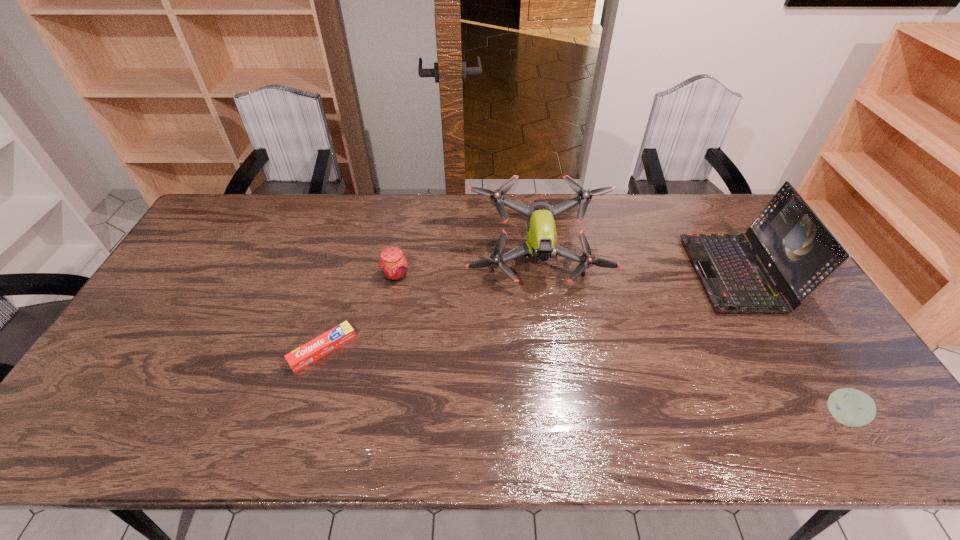
Locate an element on the screen. This screenshot has height=540, width=960. free region at the far left corner of the desktop is located at coordinates (216, 232).

Locate an element on the screen. empty space between the laptop computer and the third object from right to left is located at coordinates (637, 267).

Identify the location of blank region between the third object from left to right and the laptop computer. Image resolution: width=960 pixels, height=540 pixels. (637, 267).

At what (x,y) coordinates should I click in order to perform the action: click on vacant area between the third object from left to right and the laptop computer. Please return your answer as a coordinate pair (x, y). Looking at the image, I should click on (637, 267).

Where is `unoccupied area between the shortest object and the fourth object from right to left`? This screenshot has width=960, height=540. unoccupied area between the shortest object and the fourth object from right to left is located at coordinates [359, 312].

You are a GUI agent. You are given a task and a screenshot of the screen. Output one action in this format:
    pyautogui.click(x=<x>, y=<y>)
    Task: Click on the vacant space in between the drone and the apple
    
    Given the screenshot: What is the action you would take?
    pos(690,339)

Locate an element on the screen. This screenshot has width=960, height=540. free space between the laptop computer and the drone is located at coordinates (637, 267).

Image resolution: width=960 pixels, height=540 pixels. I want to click on unoccupied area between the nearest object and the jam, so click(x=619, y=346).

In order to click on blank region between the apple and the drone in this screenshot , I will do `click(690, 339)`.

Identify the location of object identified as the fourth closest to the nearest object. The width and height of the screenshot is (960, 540). (308, 353).